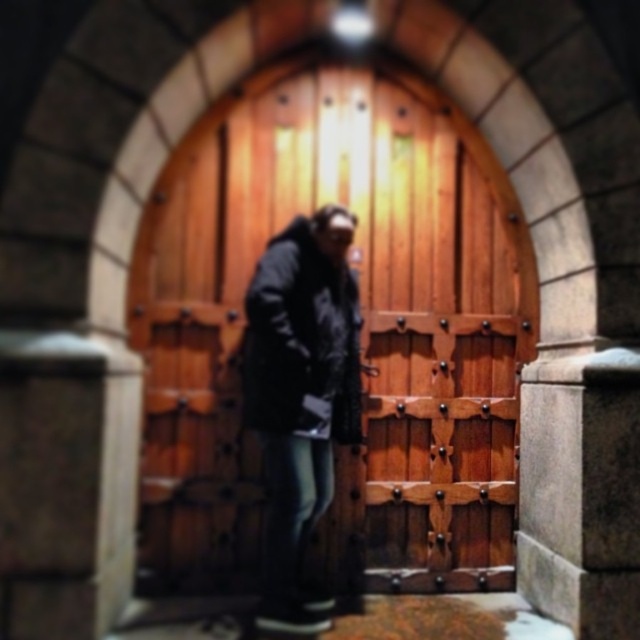
Which of these two, wooden at center or dark gray fabric jacket at center, stands taller?

wooden at center is taller.

Which is above, wooden at center or dark gray fabric jacket at center?

wooden at center is higher up.

Is point (148, 445) behind point (326, 618)?

Yes, point (148, 445) is behind point (326, 618).

Find the location of a particular element. wooden at center is located at coordinates pyautogui.click(x=362, y=333).